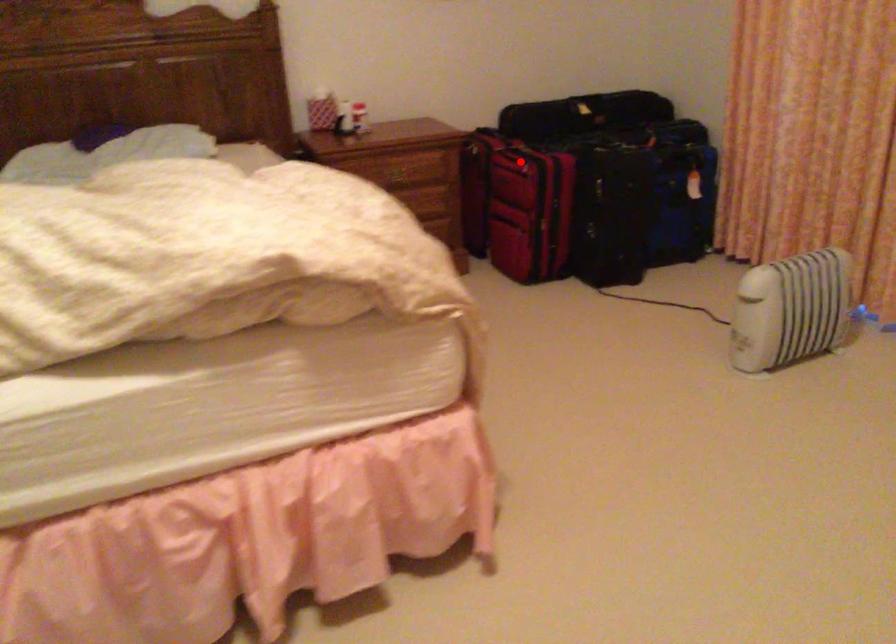
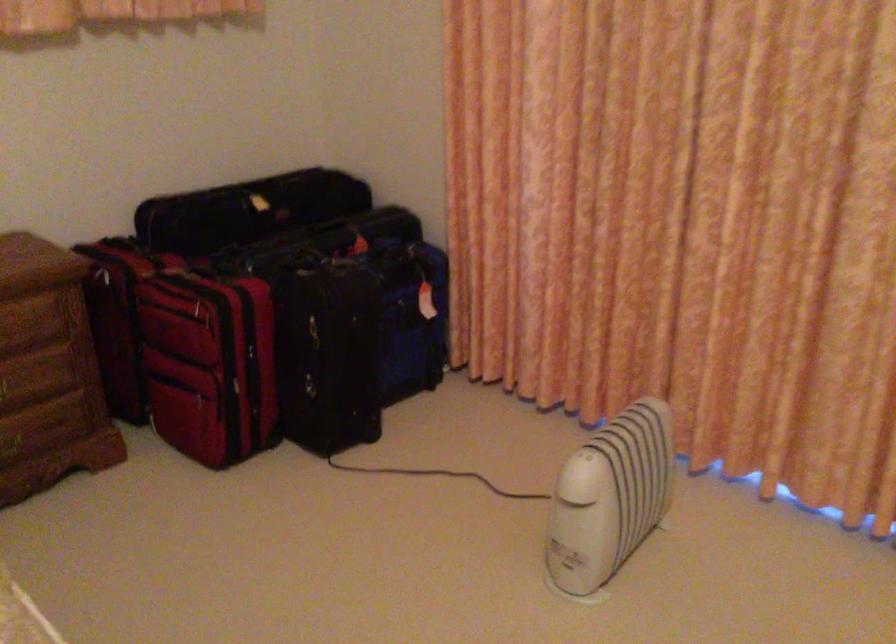
In the second image, find the point that corresponds to the highlighted location in the first image.

(202, 305)